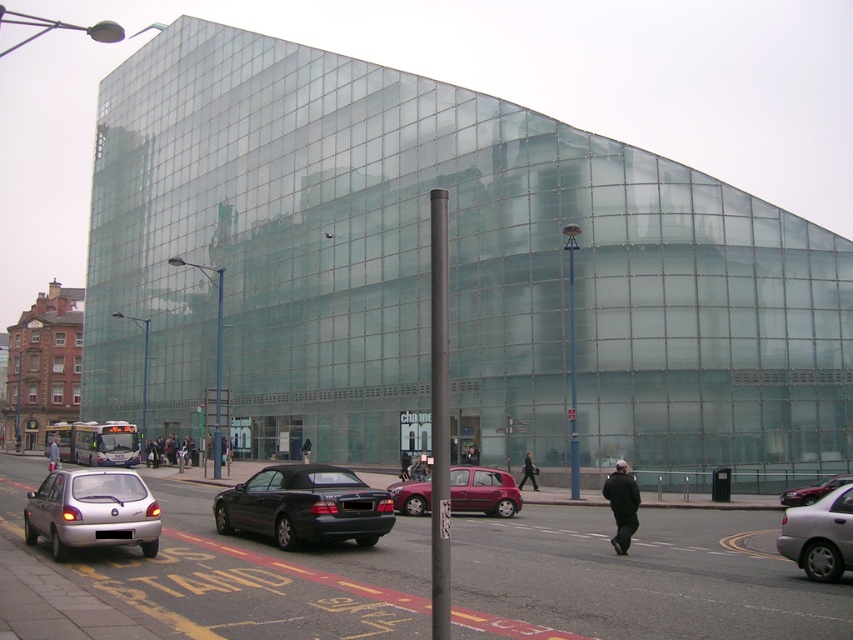
Question: Which object is farther from the camera taking this photo?

Choices:
 (A) silver metallic sedan at lower right
 (B) metallic silver car at lower right
 (C) metallic maroon hatchback at center

Answer: (B)

Question: Considering the relative positions of shiny black convertible at center and metallic silver car at lower right in the image provided, where is shiny black convertible at center located with respect to metallic silver car at lower right?

Choices:
 (A) below
 (B) above

Answer: (B)

Question: In this image, where is metallic maroon hatchback at center located relative to metallic silver car at lower right?

Choices:
 (A) left
 (B) right

Answer: (A)

Question: From the image, what is the correct spatial relationship of silver metallic hatchback at lower left in relation to silver metallic sedan at lower right?

Choices:
 (A) left
 (B) right

Answer: (A)

Question: Among these objects, which one is nearest to the camera?

Choices:
 (A) shiny black convertible at center
 (B) silver metallic hatchback at lower left

Answer: (B)

Question: Which point is farther to the camera?

Choices:
 (A) metallic silver car at lower right
 (B) silver metallic hatchback at lower left
 (C) metallic maroon hatchback at center
 (D) silver metallic sedan at lower right

Answer: (A)